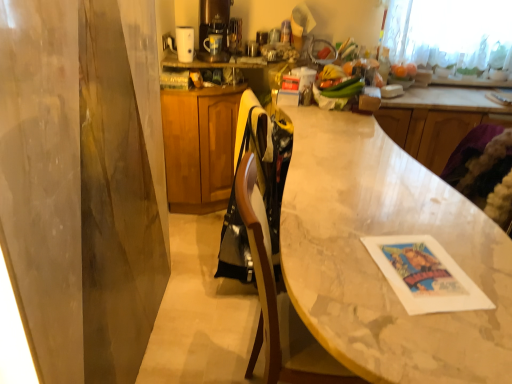
Question: Is satin gold coffee machine at upper center inside or outside of smooth orange fruit at upper right?

Choices:
 (A) inside
 (B) outside

Answer: (B)

Question: From a real-world perspective, is satin gold coffee machine at upper center positioned above or below smooth orange fruit at upper right?

Choices:
 (A) above
 (B) below

Answer: (A)

Question: Which of these objects is positioned closest to the wooden counter at upper right?

Choices:
 (A) wooden cabinet at center
 (B) white glossy coffee cup at upper center
 (C) smooth orange fruit at upper right
 (D) purple fabric swivel chair at lower right
 (E) satin gold coffee machine at upper center

Answer: (C)

Question: Estimate the real-world distances between objects in this image. Which object is closer to the wooden cabinet at center?

Choices:
 (A) smooth orange fruit at upper right
 (B) purple fabric swivel chair at lower right
 (C) satin gold coffee machine at upper center
 (D) white glossy coffee cup at upper center
 (E) wooden counter at upper right

Answer: (C)